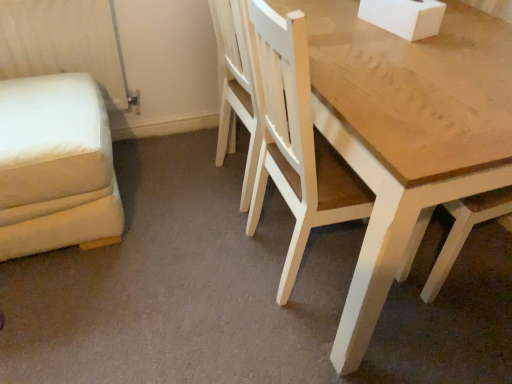
You are a GUI agent. You are given a task and a screenshot of the screen. Output one action in this format:
    pyautogui.click(x=<x>, y=<y>)
    Task: Click on the free space on the front side of white fabric swivel chair at left
    
    Given the screenshot: What is the action you would take?
    pyautogui.click(x=67, y=309)